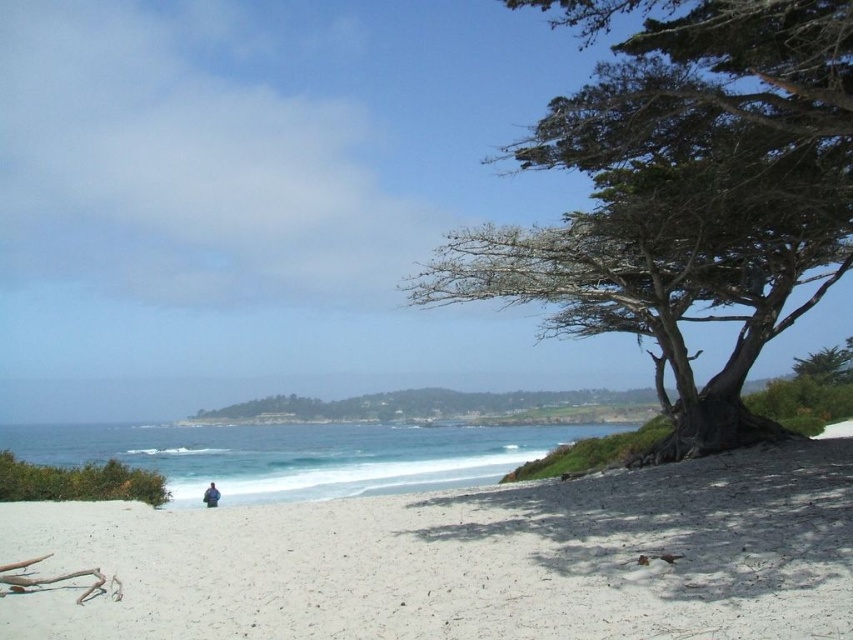
You are standing on the beach and want to walk from the point closer to you to the point further away. Which path would you take between the two points, point (103, 486) and point (206, 506)?

The path from point (103, 486) to point (206, 506) is the correct one since point (103, 486) is closer to you and point (206, 506) is further away.

You are standing on the beach and want to place a small flag exactly at the point marked as point (x=468, y=560). According to the scene description, what is the surface you will be placing the flag on?

The surface at point (x=468, y=560) is white sand at lower center, so you will be placing the flag on the white sand at lower center.